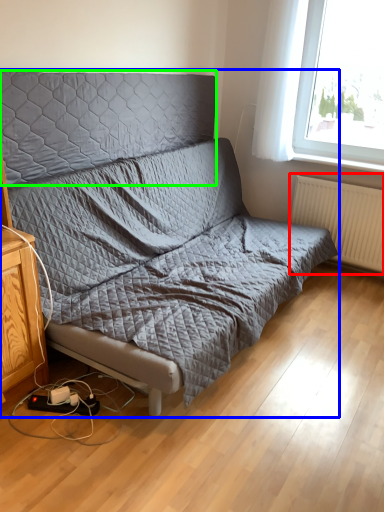
Question: Estimate the real-world distances between objects in this image. Which object is farther from radiator (highlighted by a red box), studio couch (highlighted by a blue box) or headboard (highlighted by a green box)?

Choices:
 (A) studio couch
 (B) headboard

Answer: (B)